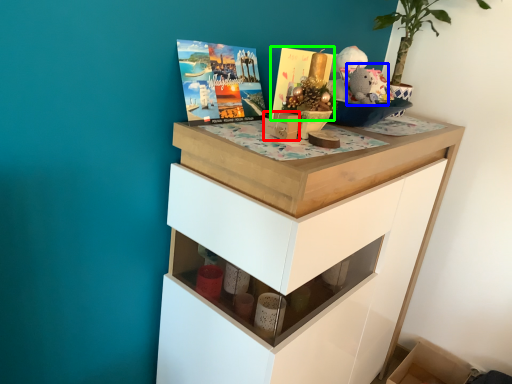
Question: Which object is positioned closest to box (highlighted by a red box)? Select from animal (highlighted by a blue box) and magazine (highlighted by a green box).

Choices:
 (A) animal
 (B) magazine

Answer: (B)